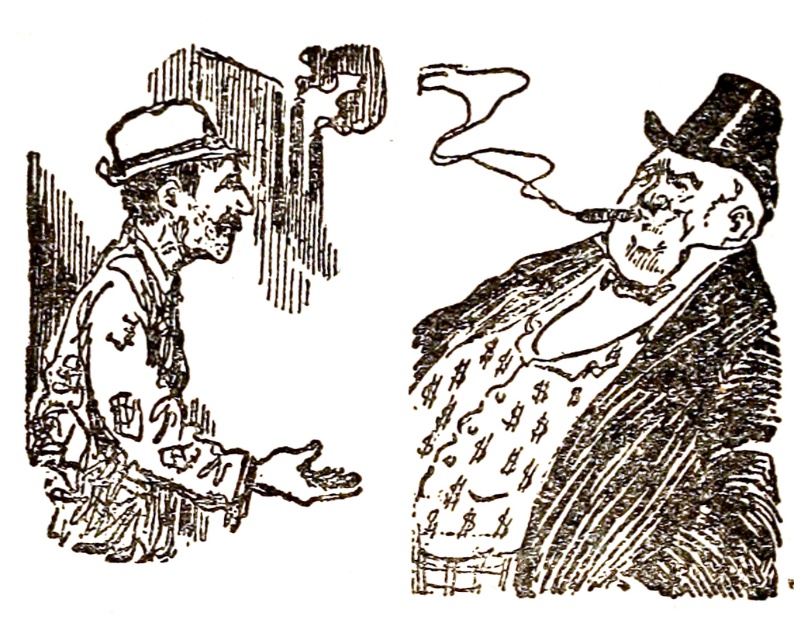
Does point (540, 474) come farther from viewer compared to point (81, 304)?

No, it is in front of (81, 304).

Is smooth paper money at right below black paper hat at left?

Yes.

I want to click on smooth paper money at right, so click(x=617, y=387).